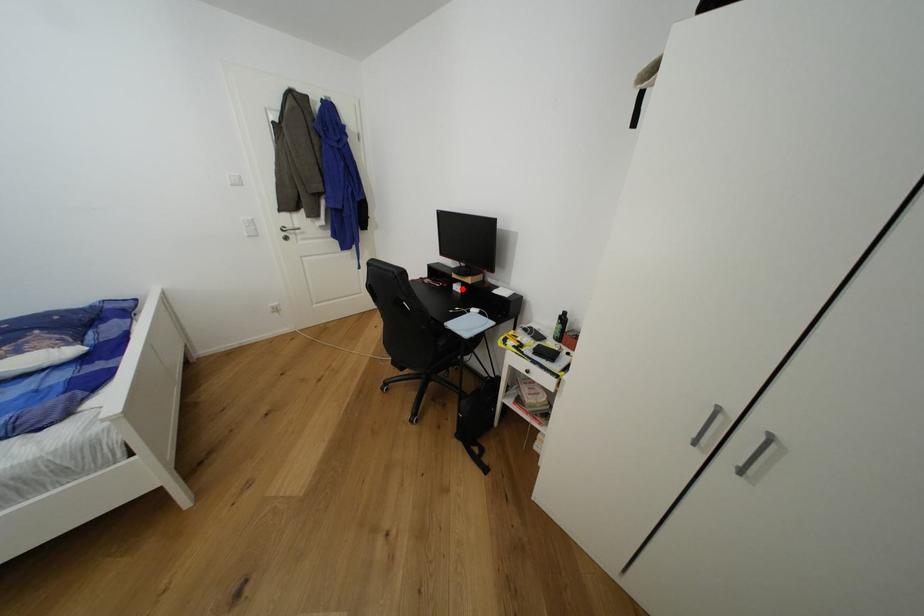
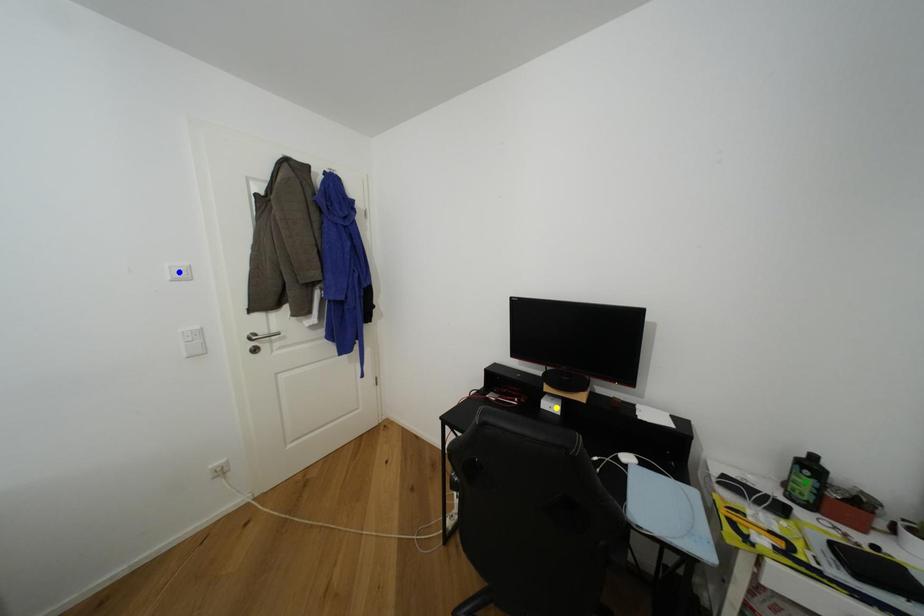
Question: I am providing you with two images of the same scene from different viewpoints. A red point is marked on the first image. You are given multiple points on the second image. In image 2, which mark is for the same physical point as the one in image 1?

Choices:
 (A) yellow point
 (B) green point
 (C) blue point

Answer: (A)